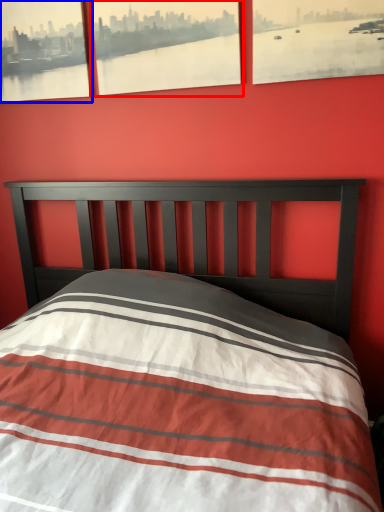
Question: Among these objects, which one is farthest to the camera, picture frame (highlighted by a red box) or picture frame (highlighted by a blue box)?

Choices:
 (A) picture frame
 (B) picture frame

Answer: (B)